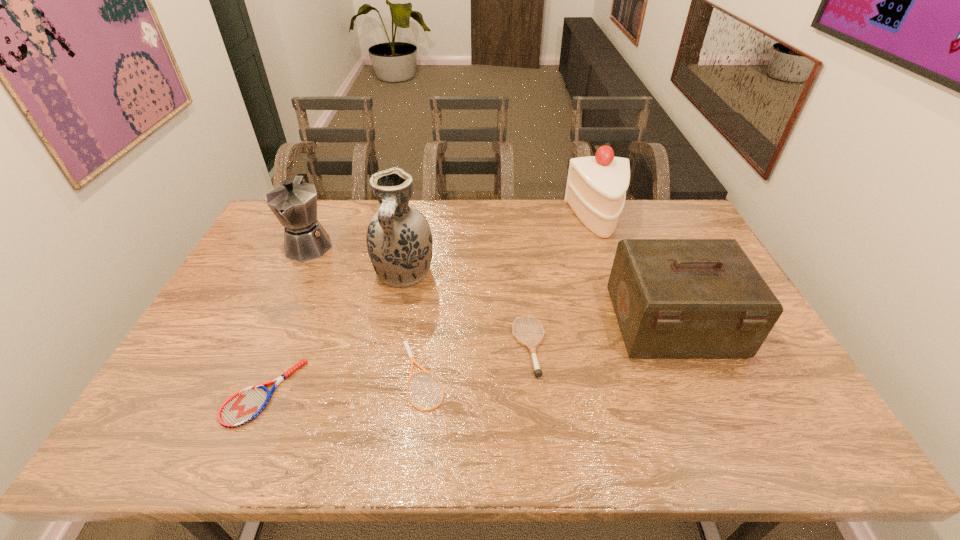
Identify which tennis racket is the closest to the leftmost tennis racket. Please provide its 2D coordinates. Your answer should be formatted as a tuple, i.e. [(x, y)], where the tuple contains the x and y coordinates of a point satisfying the conditions above.

[(405, 343)]

I want to click on free space in the image that satisfies the following two spatial constraints: 1. with the handle on the side of the vase; 2. on the left side of the second tennis racket from left to right, so click(384, 376).